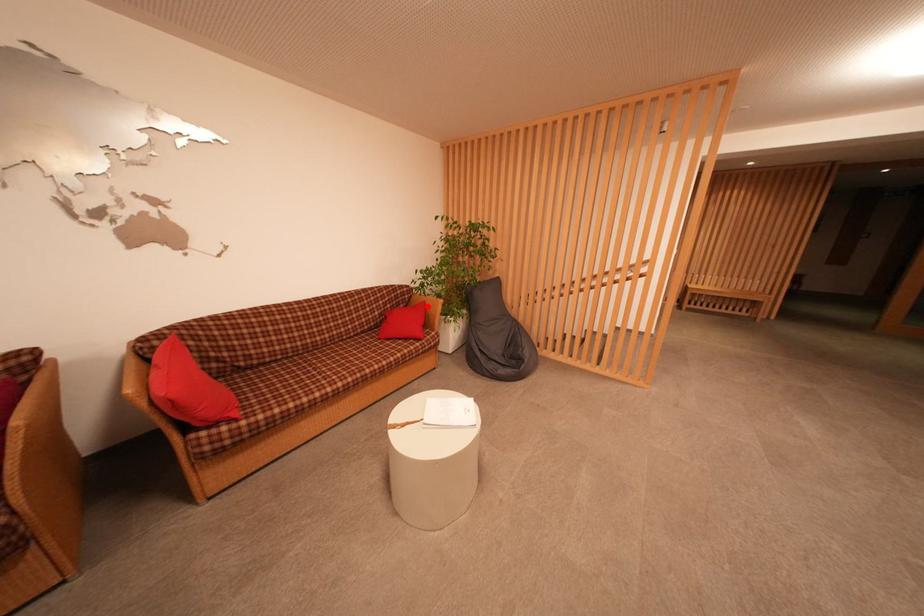
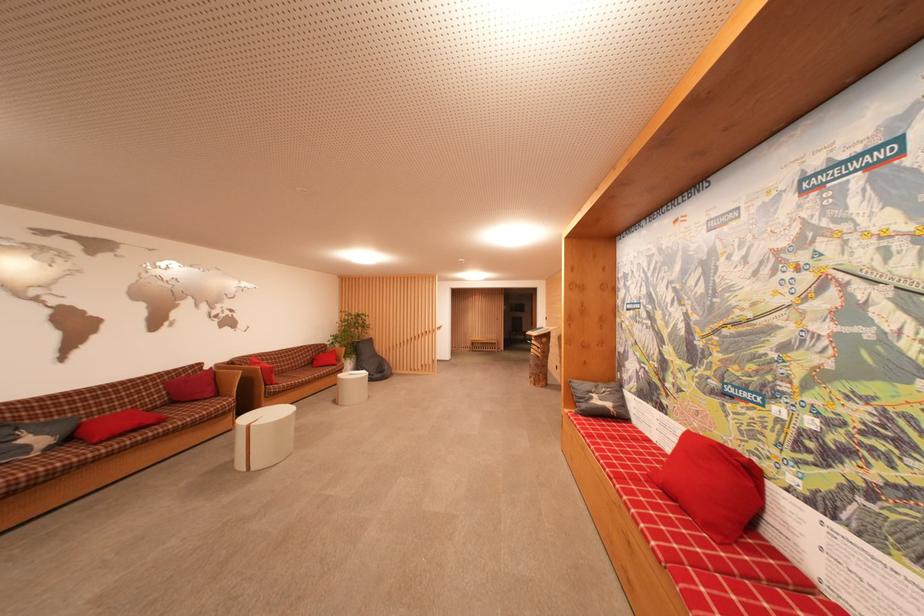
Where in the second image is the point corresponding to the highlighted location from the first image?

(338, 354)